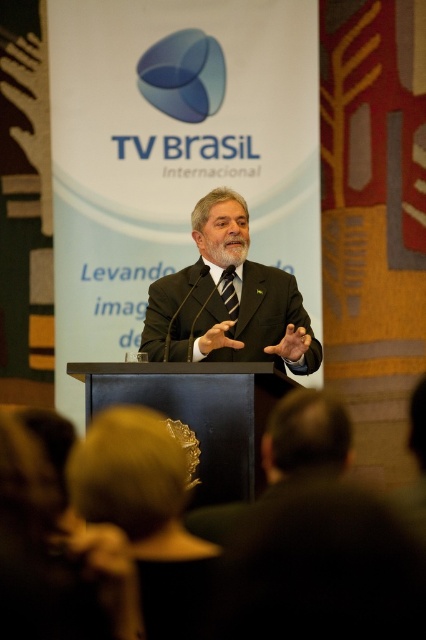
Based on the scene description, can you determine if the matte black suit at center is wider than the blurred hair at lower left?

Answer: The matte black suit at center might be wider than blurred hair at lower left according to the description.

You are an event photographer at the TV Brasil Internacional event. You need to capture a clear shot of the speaker. The silky yellow hat at lower center and the blurred hair at lower left are both in the frame. Which object is taller in the image?

The silky yellow hat at lower center has a greater height compared to blurred hair at lower left, so the silky yellow hat at lower center is taller in the image.

You are a photographer at the event and need to capture a closeup shot of the speaker. The camera you are using has a maximum focus range of 15 feet. Can you focus on both the blurred hair at lower left and the black striped tie at center in the same photo?

The blurred hair at lower left and the black striped tie at center are 16.15 feet apart from each other. Since the camera has a maximum focus range of 15 feet, it cannot focus on both objects simultaneously as the distance exceeds the camera limit.